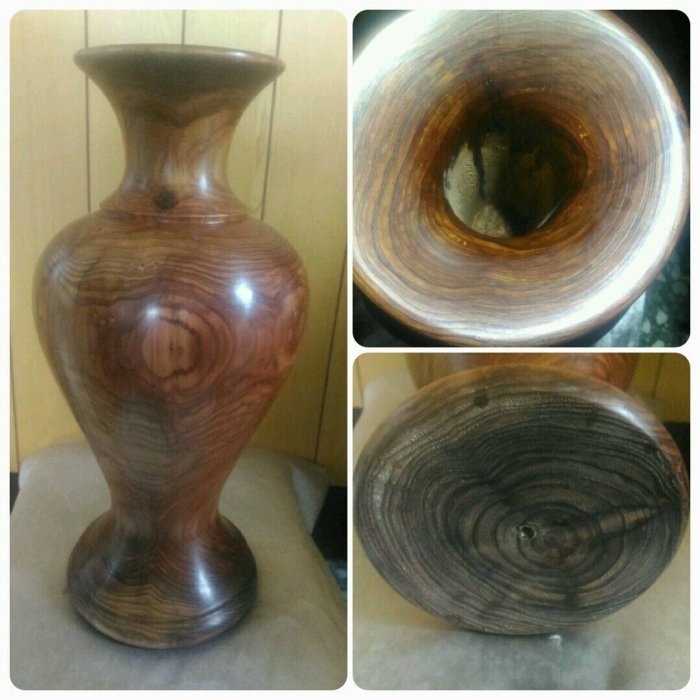
Where is `white borders`? white borders is located at coordinates (691, 694).